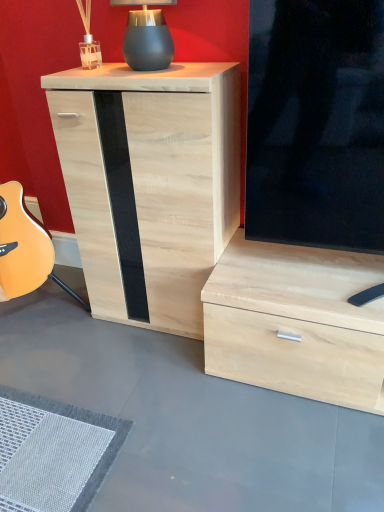
This screenshot has height=512, width=384. Identify the location of free space underneath matte black lamp at upper center (from a real-world perspective). (160, 67).